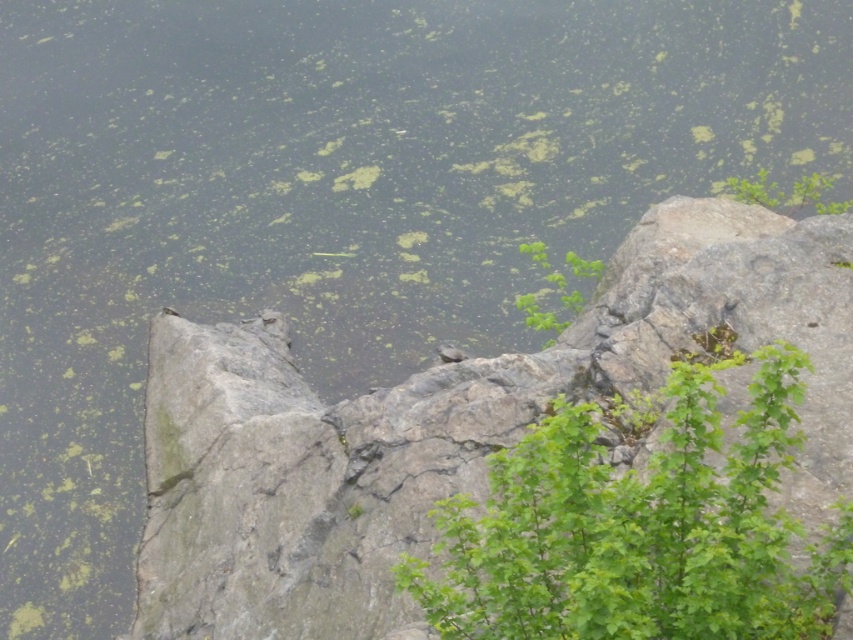
Consider the image. Is green leafy plant at upper center bigger than green leafy plant at upper right?

Correct, green leafy plant at upper center is larger in size than green leafy plant at upper right.

Is point (537, 307) behind point (784, 202)?

That is False.

Identify the location of green leafy plant at upper center. (556, 289).

Does green leafy plant at center appear on the right side of green leafy plant at upper right?

Incorrect, green leafy plant at center is not on the right side of green leafy plant at upper right.

Does green leafy plant at center lie in front of green leafy plant at upper right?

Yes, it is.

What do you see at coordinates (641, 525) in the screenshot?
I see `green leafy plant at center` at bounding box center [641, 525].

At what (x,y) coordinates should I click in order to perform the action: click on green leafy plant at center. Please return your answer as a coordinate pair (x, y). The image size is (853, 640). Looking at the image, I should click on (641, 525).

In the scene shown: Who is more forward, (x=564, y=586) or (x=552, y=317)?

Positioned in front is point (x=564, y=586).

Who is more distant from viewer, [625,561] or [561,273]?

Point [561,273]

Is point (711, 426) closer to camera compared to point (555, 316)?

That is True.

Identify the location of green leafy plant at center. (641, 525).